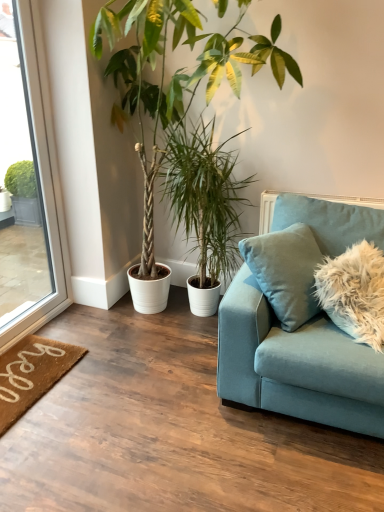
Identify the location of free space above brown coir doormat at lower left (from a real-world perspective). (29, 365).